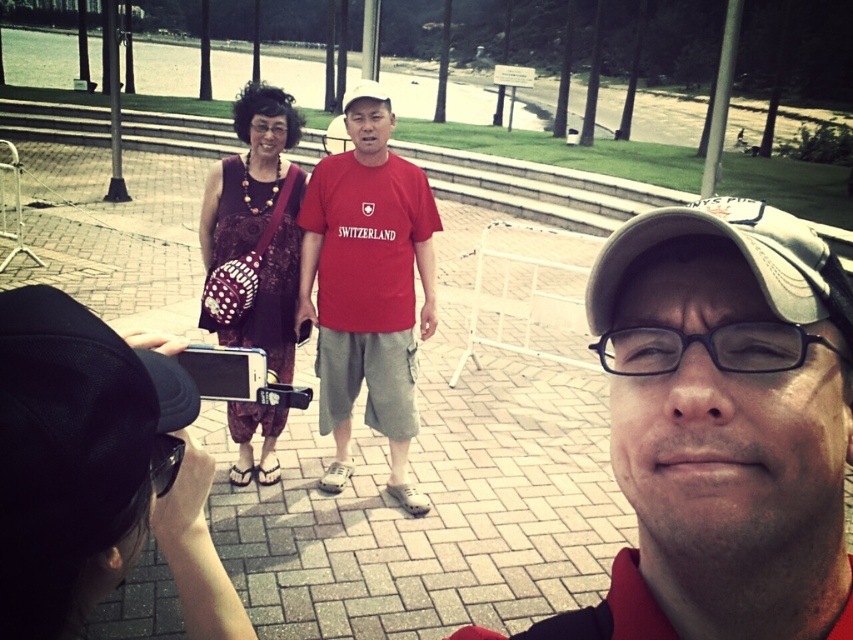
Question: Considering the relative positions of matte red t-shirt at center and dotted fabric dress at center in the image provided, where is matte red t-shirt at center located with respect to dotted fabric dress at center?

Choices:
 (A) below
 (B) above

Answer: (A)

Question: Is matte red t-shirt at center smaller than dotted fabric dress at center?

Choices:
 (A) yes
 (B) no

Answer: (A)

Question: Among these objects, which one is farthest from the camera?

Choices:
 (A) matte red t-shirt at center
 (B) dotted fabric dress at center

Answer: (A)

Question: From the image, what is the correct spatial relationship of matte red t-shirt at center in relation to dotted fabric dress at center?

Choices:
 (A) below
 (B) above

Answer: (A)